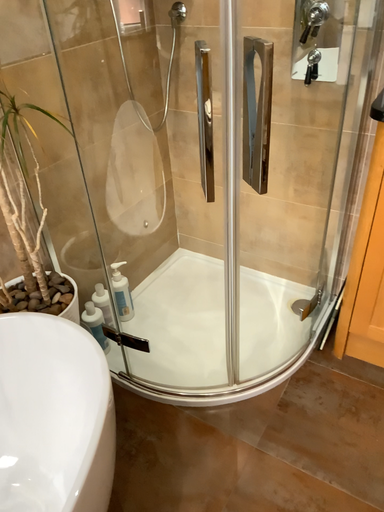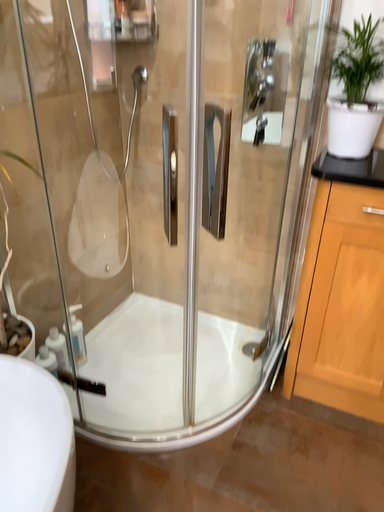
Question: Which way did the camera rotate in the video?

Choices:
 (A) rotated downward
 (B) rotated upward

Answer: (B)